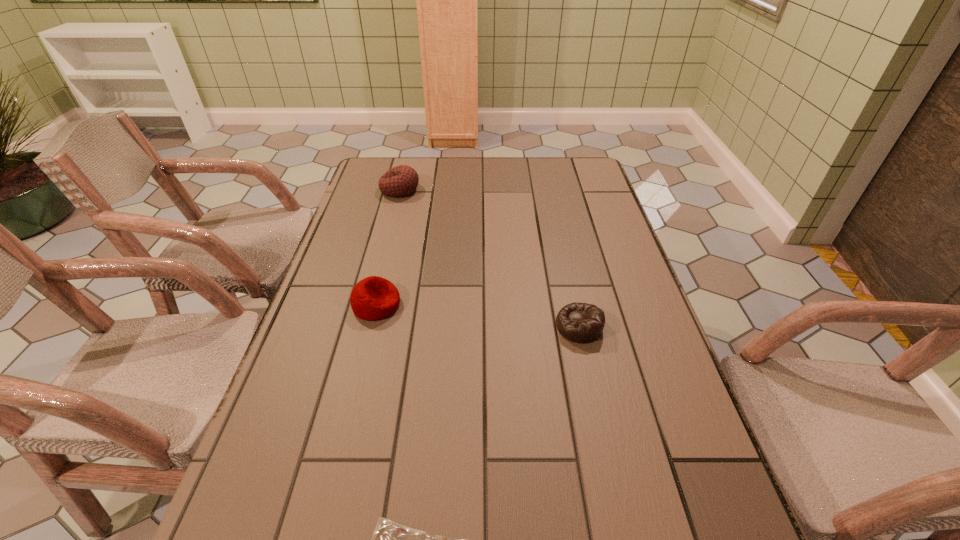
Identify the location of the farthest beanbag. (402, 180).

What are the coordinates of `the second shortest beanbag` in the screenshot? It's located at (373, 298).

You are a GUI agent. You are given a task and a screenshot of the screen. Output one action in this format:
    pyautogui.click(x=<x>, y=<y>)
    Task: Click on the shortest beanbag
    The width and height of the screenshot is (960, 540).
    Given the screenshot: What is the action you would take?
    pyautogui.click(x=583, y=323)

The height and width of the screenshot is (540, 960). I want to click on the rightmost beanbag, so click(583, 323).

The image size is (960, 540). Identify the location of blank area located 0.280m on the front of the farthest beanbag. (383, 256).

Identify the location of blank space located 0.190m on the seat area of the third shortest object. The height and width of the screenshot is (540, 960). (480, 305).

Find the location of `blank space located 0.360m on the front of the third tallest object`. blank space located 0.360m on the front of the third tallest object is located at coordinates (622, 521).

At what (x,y) coordinates should I click in order to perform the action: click on object that is at the far edge. Please return your answer as a coordinate pair (x, y). The width and height of the screenshot is (960, 540). Looking at the image, I should click on point(402,180).

The image size is (960, 540). I want to click on object that is at the right edge, so click(x=583, y=323).

Where is `object that is at the far left corner`? Image resolution: width=960 pixels, height=540 pixels. object that is at the far left corner is located at coordinates (402, 180).